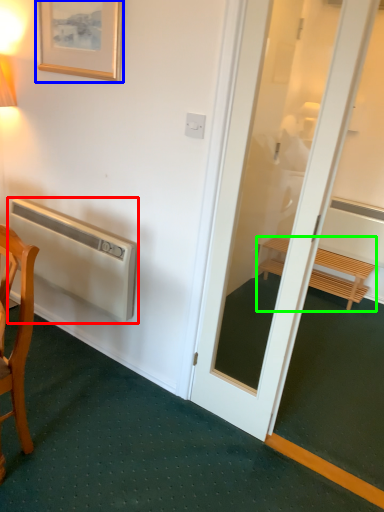
Question: Considering the real-world distances, which object is farthest from air conditioner (highlighted by a red box)? picture frame (highlighted by a blue box) or furniture (highlighted by a green box)?

Choices:
 (A) picture frame
 (B) furniture

Answer: (B)